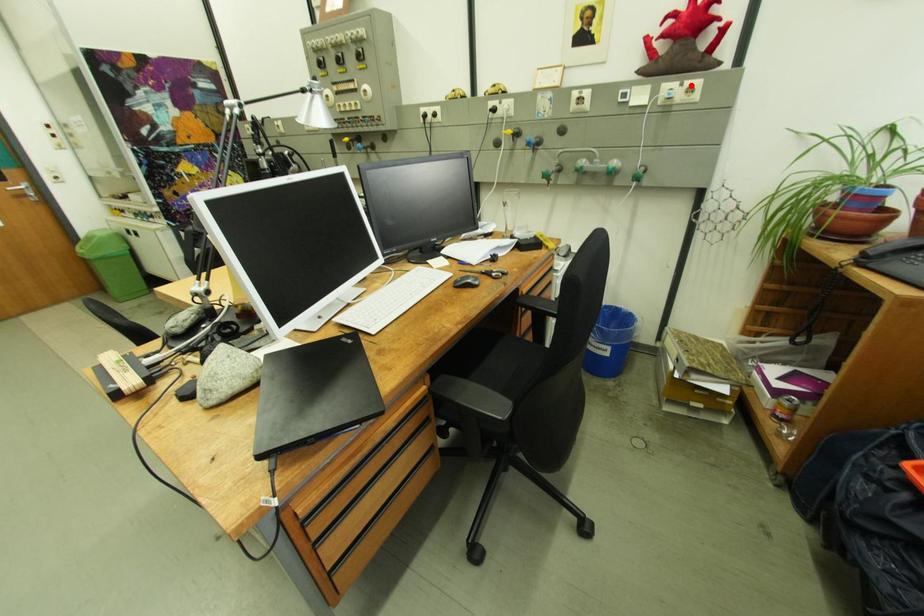
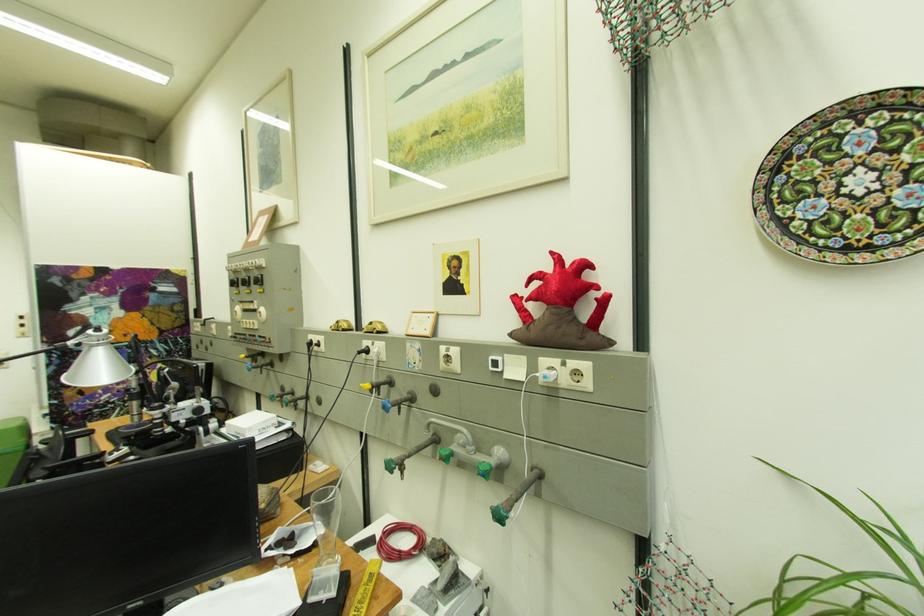
Question: I am providing you with two images of the same scene from different viewpoints. A red point is marked on the first image. Can you still see the location of the red point in image 2?

Choices:
 (A) Yes
 (B) No

Answer: (A)